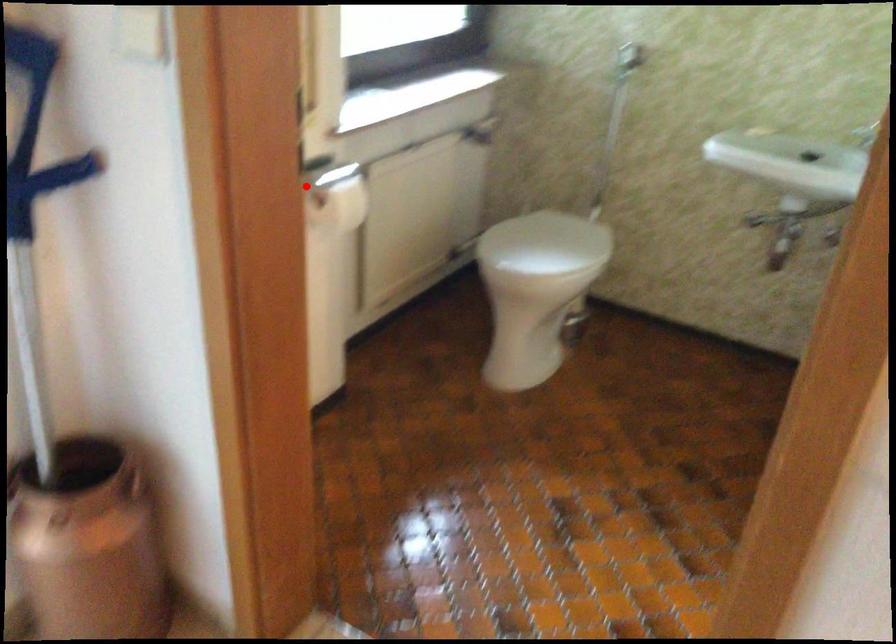
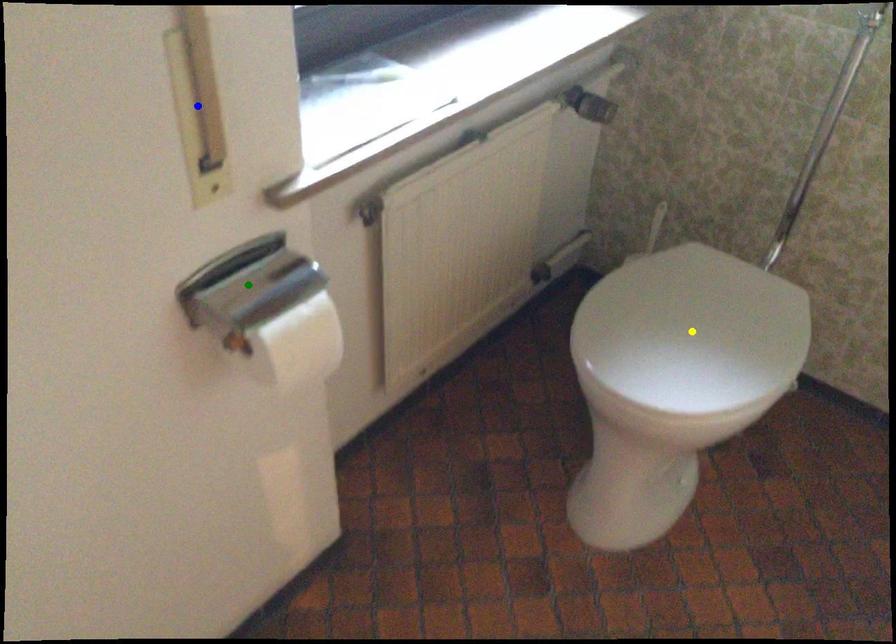
Question: I am providing you with two images of the same scene from different viewpoints. A red point is marked on the first image. You are given multiple points on the second image. Which point in image 2 represents the same 3d spot as the red point in image 1?

Choices:
 (A) yellow point
 (B) green point
 (C) blue point

Answer: (B)